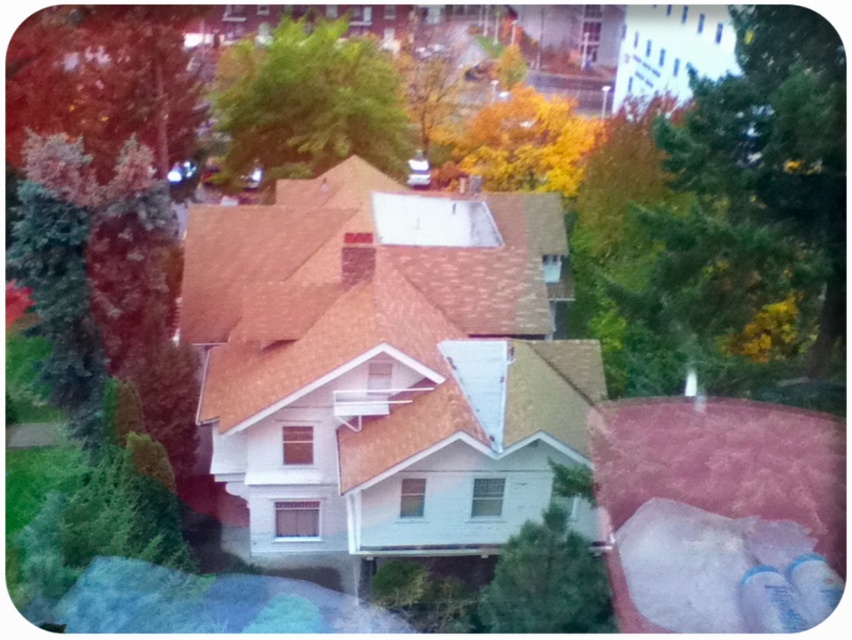
You are a bird looking for a place to perch. You see the smooth red bark tree at upper left and the yellow autumn leaves at upper center. Which one is taller?

The smooth red bark tree at upper left is taller than the yellow autumn leaves at upper center, so you should choose the smooth red bark tree at upper left for perching.

You are standing in the residential area with the house and trees. There is a point at coordinates point (104,77). What is the nearest object to this point?

The point (104,77) is on smooth red bark tree at upper left, so the nearest object to this point is the smooth red bark tree at upper left.

You are standing in the residential area and want to find the smooth red bark tree at upper left. According to the scene, where would you look relative to the green leafy tree at upper center?

The smooth red bark tree at upper left is positioned under the green leafy tree at upper center, so you should look below the green leafy tree at upper center to find it.